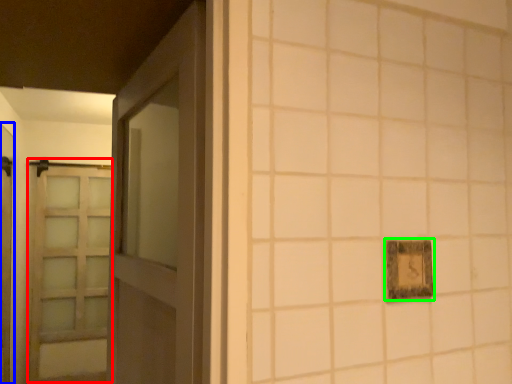
Question: Which object is the farthest from barn door (highlighted by a red box)? Choose among these: elevator (highlighted by a blue box) or picture frame (highlighted by a green box).

Choices:
 (A) elevator
 (B) picture frame

Answer: (B)